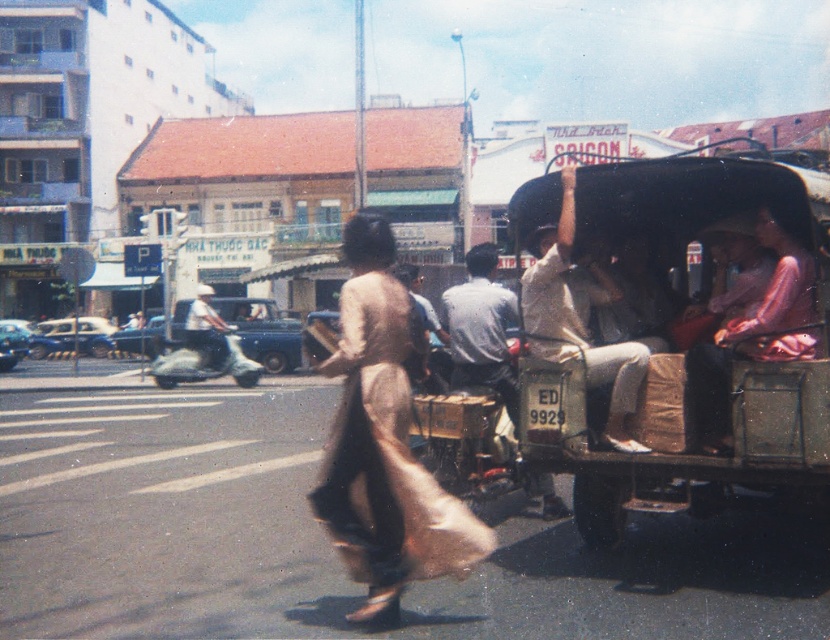
Question: Does light beige fabric shirt at center have a greater width compared to blue metallic scooter at center-left?

Choices:
 (A) no
 (B) yes

Answer: (A)

Question: Does wooden cart at right appear on the right side of light beige fabric shirt at center?

Choices:
 (A) yes
 (B) no

Answer: (A)

Question: Based on their relative distances, which object is nearer to the pink satin dress at center?

Choices:
 (A) blue metallic scooter at center-left
 (B) light brown silk ao dai at center
 (C) light beige fabric shirt at center
 (D) light blue fabric scooter at center-left

Answer: (C)

Question: Which point appears closest to the camera in this image?

Choices:
 (A) (72, 344)
 (B) (702, 368)
 (C) (196, 348)

Answer: (B)

Question: Which is nearer to the pink satin dress at center?

Choices:
 (A) light beige fabric shirt at center
 (B) light brown silk ao dai at center
 (C) light blue fabric scooter at center-left
 (D) wooden cart at right

Answer: (D)

Question: Does light blue fabric scooter at center-left have a larger size compared to blue metallic car at left?

Choices:
 (A) yes
 (B) no

Answer: (A)